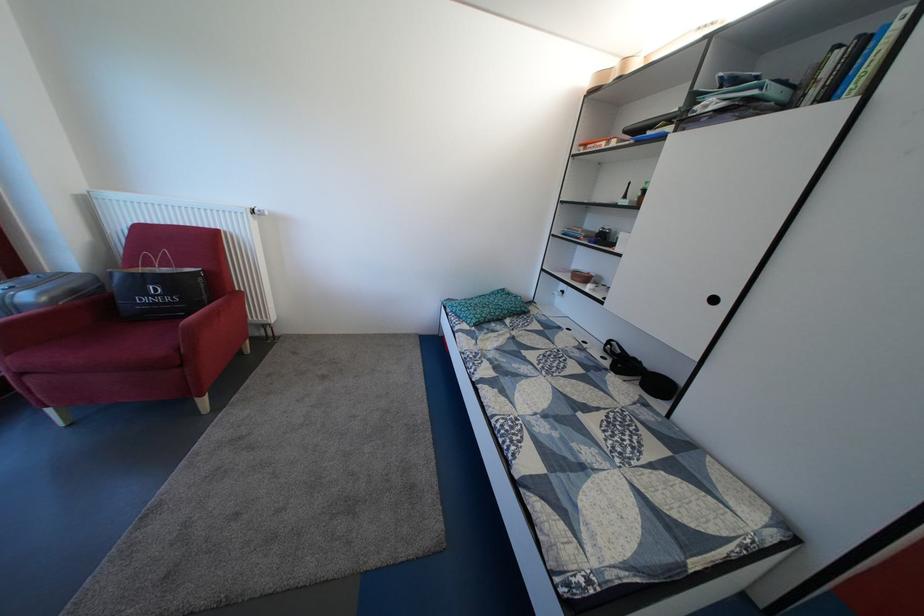
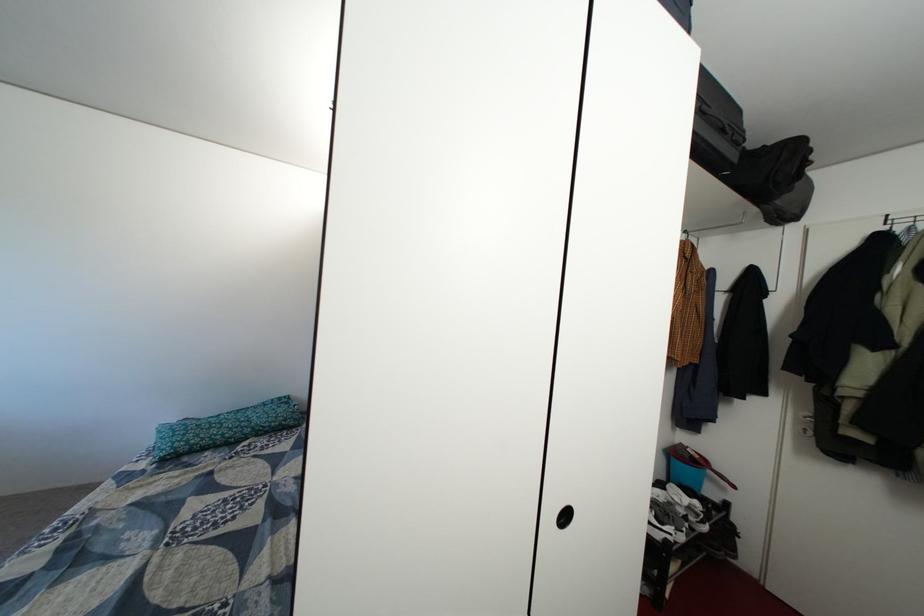
Locate, in the second image, the point that corresponds to [494,314] in the first image.

(222, 435)